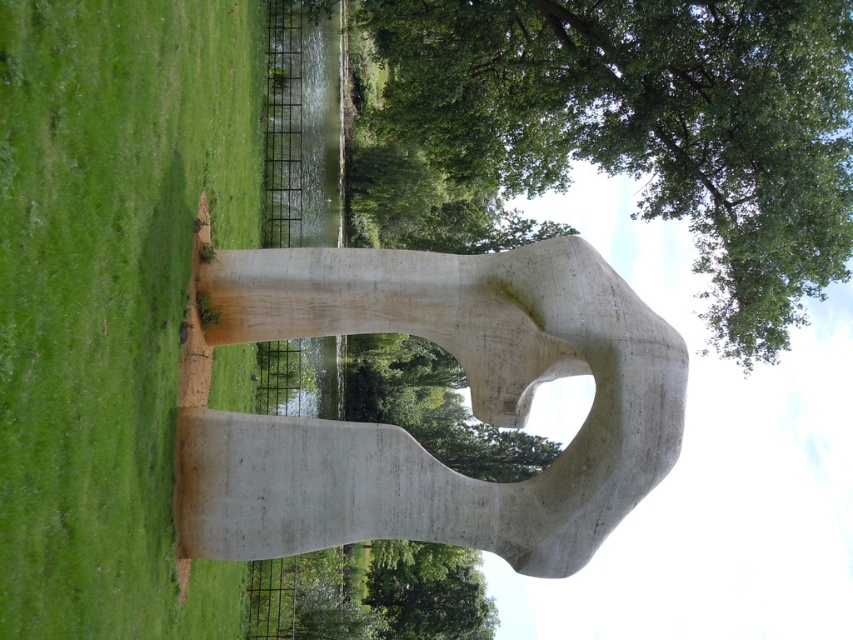
Question: Does smooth concrete sculpture at center appear over green leafy tree at upper center?

Choices:
 (A) no
 (B) yes

Answer: (A)

Question: Which object is closer to the camera taking this photo?

Choices:
 (A) green leafy tree at upper center
 (B) smooth concrete sculpture at center

Answer: (B)

Question: Is smooth concrete sculpture at center smaller than green leafy tree at upper center?

Choices:
 (A) no
 (B) yes

Answer: (B)

Question: Among these points, which one is farthest from the camera?

Choices:
 (A) (256, 417)
 (B) (761, 68)

Answer: (B)

Question: Considering the relative positions of smooth concrete sculpture at center and green leafy tree at upper center in the image provided, where is smooth concrete sculpture at center located with respect to green leafy tree at upper center?

Choices:
 (A) above
 (B) below

Answer: (B)

Question: Which point is closer to the camera?

Choices:
 (A) smooth concrete sculpture at center
 (B) green leafy tree at upper center

Answer: (A)